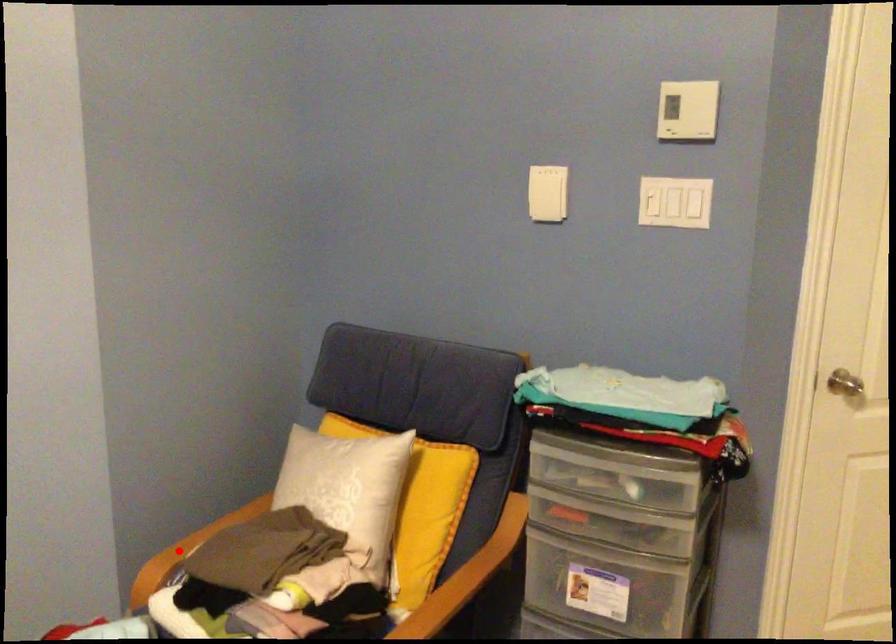
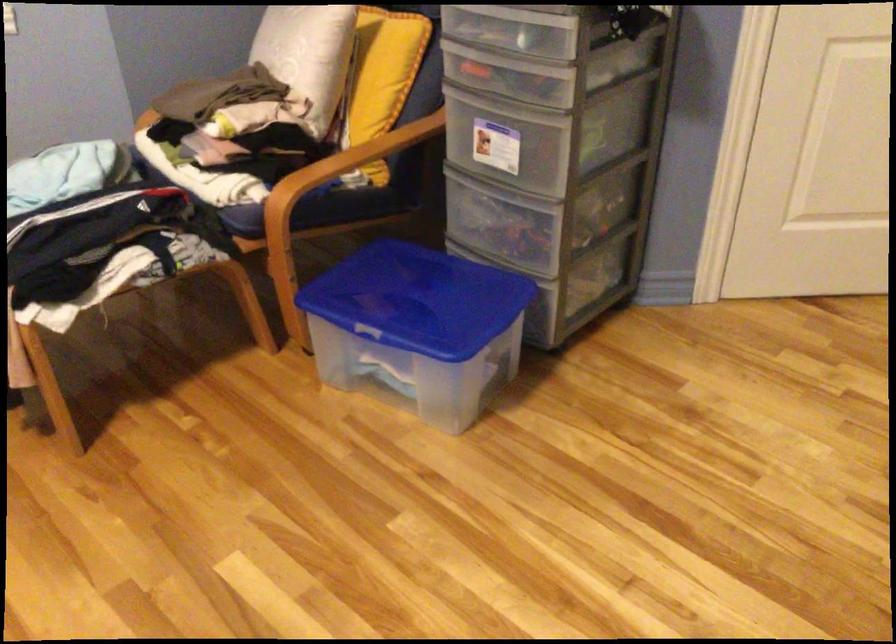
Question: I am providing you with two images of the same scene from different viewpoints. A red point is marked on the first image. Is the red point's position out of view in image 2?

Choices:
 (A) Yes
 (B) No

Answer: (A)